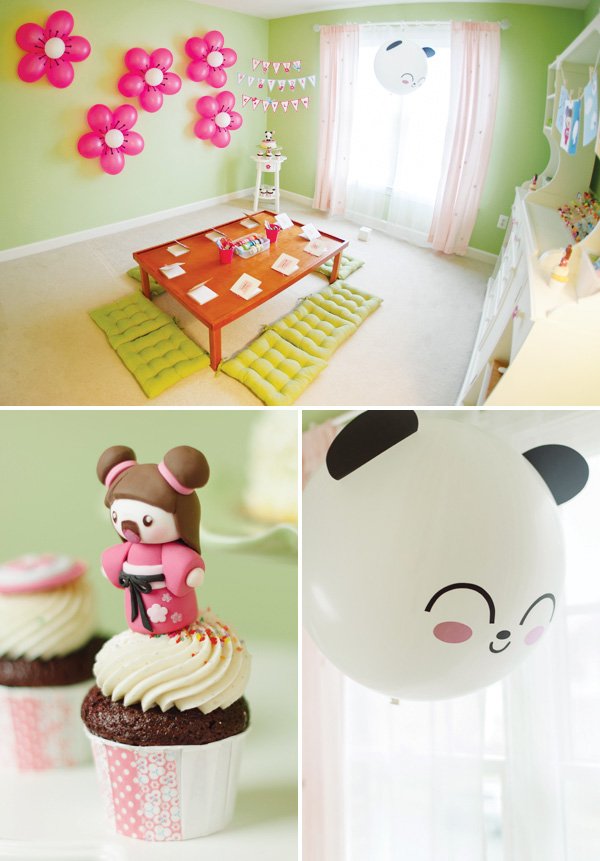
I want to click on pastel green walls, so click(53, 181), click(538, 40), click(294, 38).